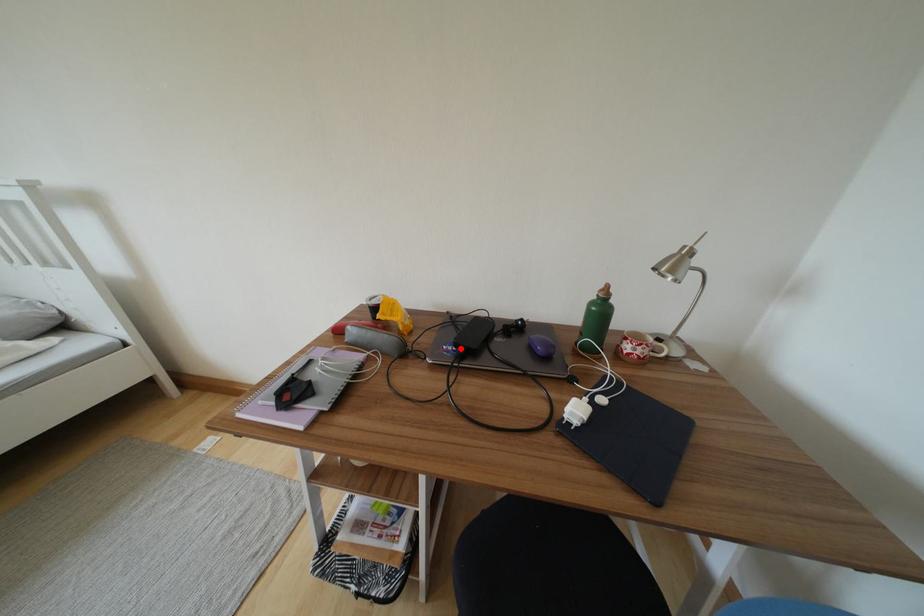
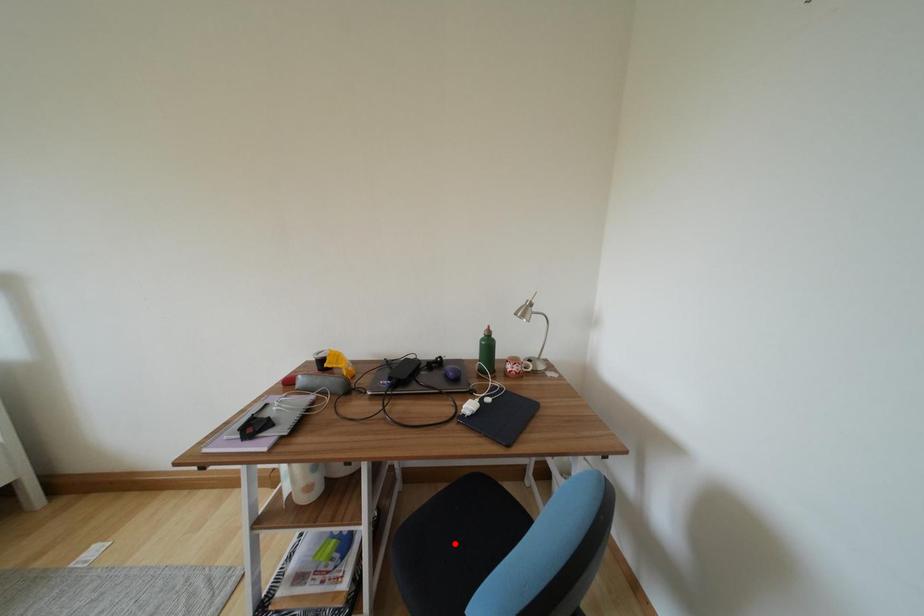
I am providing you with two images of the same scene from different viewpoints. A red point is marked on the first image and another point is marked on the second image. Does the point marked in image1 correspond to the same location as the one in image2?

No